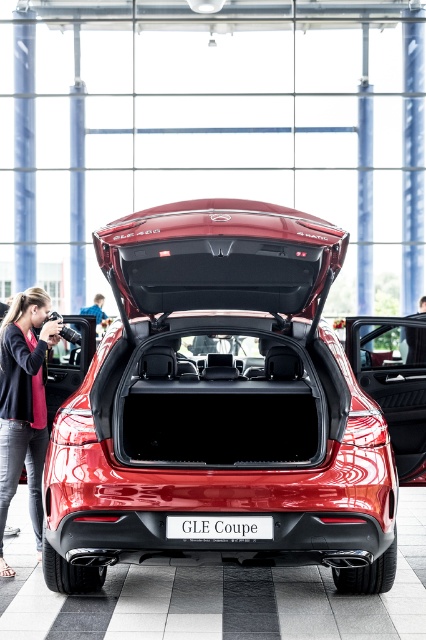
Question: Does glossy metallic car at center appear under white plastic license plate at center?

Choices:
 (A) no
 (B) yes

Answer: (A)

Question: Which point is closer to the camera?

Choices:
 (A) (290, 232)
 (B) (31, 380)
 (C) (236, 518)
 (D) (368, 344)

Answer: (A)

Question: Which object appears farthest from the camera in this image?

Choices:
 (A) glossy metallic suv at center
 (B) white plastic license plate at center
 (C) pink fabric jacket at lower left

Answer: (C)

Question: Which point appears closest to the camera in this image?

Choices:
 (A) (397, 340)
 (B) (201, 388)
 (C) (229, 518)

Answer: (C)

Question: Does pink fabric jacket at lower left appear under glossy metallic car at center?

Choices:
 (A) yes
 (B) no

Answer: (A)

Question: In this image, where is pink fabric jacket at lower left located relative to white plastic license plate at center?

Choices:
 (A) below
 (B) above

Answer: (B)